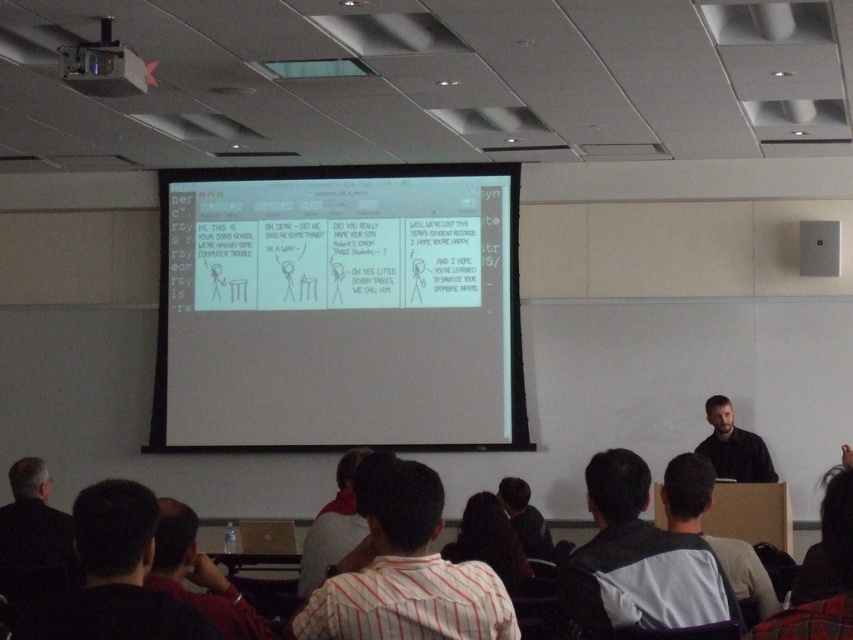
Question: Which point appears farthest from the camera in this image?

Choices:
 (A) (140, 520)
 (B) (339, 547)

Answer: (B)

Question: From the image, what is the correct spatial relationship of dark gray shirt at center in relation to matte black speaker at upper right?

Choices:
 (A) right
 (B) left

Answer: (B)

Question: Which of the following is the farthest from the observer?

Choices:
 (A) dark brown hair at lower center
 (B) white striped shirt at center
 (C) metallic projector at upper left

Answer: (A)

Question: Which point is farther to the camera?

Choices:
 (A) metallic projector at upper left
 (B) dark gray shirt at center

Answer: (A)

Question: Is white shirt at center positioned at the back of metallic projector at upper left?

Choices:
 (A) yes
 (B) no

Answer: (B)

Question: From the image, what is the correct spatial relationship of dark brown shirt at lower left in relation to metallic projector at upper left?

Choices:
 (A) left
 (B) right

Answer: (B)